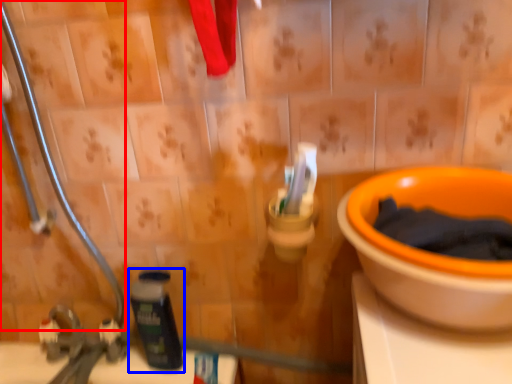
Question: Which object appears closest to the camera in this image, pipe (highlighted by a red box) or bottle (highlighted by a blue box)?

Choices:
 (A) pipe
 (B) bottle

Answer: (A)